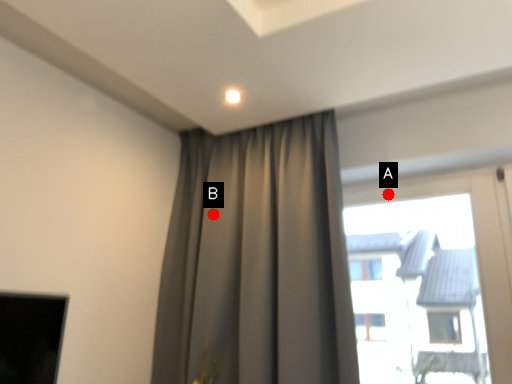
Question: Two points are circled on the image, labeled by A and B beside each circle. Which of the following is the closest to the observer?

Choices:
 (A) A is closer
 (B) B is closer

Answer: (B)